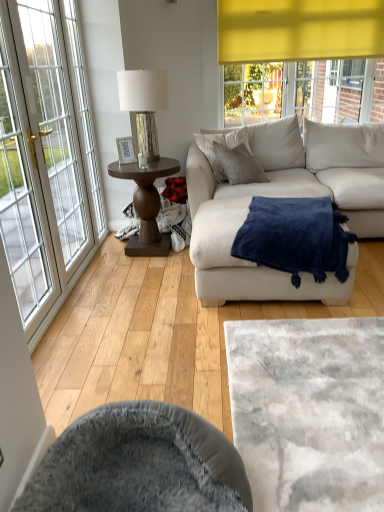
In order to face velvet grey swivel chair at lower center, should I rotate leftwards or rightwards?

Rotate your view left by about 6.720°.

Consider the image. Measure the distance between point (x=141, y=123) and camera.

The distance of point (x=141, y=123) from camera is 3.03 meters.

Describe the element at coordinates (285, 196) in the screenshot. I see `beige fabric couch at center` at that location.

Describe the element at coordinates (309, 411) in the screenshot. I see `velvety gray cat bed at lower center` at that location.

Find the location of a particular element. This screenshot has height=512, width=384. velvety gray cat bed at lower center is located at coordinates (309, 411).

This screenshot has width=384, height=512. In order to click on velvet grey swivel chair at lower center in this screenshot , I will do `click(139, 464)`.

Find the location of a particular element. window lying in front of the metallic silver table lamp at center left is located at coordinates (47, 157).

Could you tell me if white glass window at left is turned towards metallic silver table lamp at center left?

Yes, white glass window at left is aimed at metallic silver table lamp at center left.

Between white glass window at left and metallic silver table lamp at center left, which one has larger width?

With larger width is metallic silver table lamp at center left.

From the image's perspective, would you say white glass window at left is shown under metallic silver table lamp at center left?

Correct, white glass window at left appears lower than metallic silver table lamp at center left in the image.

From the image's perspective, which is below, navy blue plush blanket at center or velvety gray cat bed at lower center?

From the image's view, velvety gray cat bed at lower center is below.

Is navy blue plush blanket at center not within velvety gray cat bed at lower center?

Yes, navy blue plush blanket at center is located beyond the bounds of velvety gray cat bed at lower center.

Does navy blue plush blanket at center lie behind velvety gray cat bed at lower center?

Yes, navy blue plush blanket at center is further from the viewer.

How different are the orientations of navy blue plush blanket at center and velvety gray cat bed at lower center in degrees?

There is a 91.2-degree angle between the facing directions of navy blue plush blanket at center and velvety gray cat bed at lower center.

Between point (213, 173) and point (14, 2), which one is positioned in front?

The point (14, 2) is closer to the camera.

Which of these two, textured gray pillow at center or white glass window at left, stands taller?

With more height is white glass window at left.

Would you say white glass window at left is part of textured gray pillow at center's contents?

That's incorrect, white glass window at left is not inside textured gray pillow at center.

Considering the relative positions of textured gray pillow at center and white glass window at left in the image provided, is textured gray pillow at center to the right of white glass window at left from the viewer's perspective?

Indeed, textured gray pillow at center is positioned on the right side of white glass window at left.

Is beige fabric couch at center positioned beyond the bounds of textured gray pillow at center?

Indeed, beige fabric couch at center is completely outside textured gray pillow at center.

From a real-world perspective, who is located lower, beige fabric couch at center or textured gray pillow at center?

beige fabric couch at center, from a real-world perspective.

Is beige fabric couch at center oriented away from textured gray pillow at center?

That's right, beige fabric couch at center is facing away from textured gray pillow at center.

Is beige fabric couch at center closer to camera compared to textured gray pillow at center?

Yes, beige fabric couch at center is closer to the viewer.

Looking at this image, which of these two, light brown wood flooring at center or dark brown wood side table at center left, is wider?

With larger width is light brown wood flooring at center.

From the image's perspective, is light brown wood flooring at center over dark brown wood side table at center left?

No.

Does light brown wood flooring at center touch dark brown wood side table at center left?

No, light brown wood flooring at center is not making contact with dark brown wood side table at center left.

From their relative heights in the image, would you say white glass window at left is taller or shorter than light brown wood flooring at center?

Clearly, white glass window at left is taller compared to light brown wood flooring at center.

Looking at this image, from a real-world perspective, who is located lower, white glass window at left or light brown wood flooring at center?

light brown wood flooring at center is physically lower.

Is white glass window at left oriented towards light brown wood flooring at center?

Yes.

Looking at this image, can we say white glass window at left lies outside light brown wood flooring at center?

That's correct, white glass window at left is outside of light brown wood flooring at center.

Based on the photo, is light brown wood flooring at center a part of navy blue plush blanket at center?

No, light brown wood flooring at center is located outside of navy blue plush blanket at center.

Who is shorter, navy blue plush blanket at center or light brown wood flooring at center?

light brown wood flooring at center.

Does navy blue plush blanket at center have a smaller size compared to light brown wood flooring at center?

Yes.

This screenshot has width=384, height=512. In order to click on window below the metallic silver table lamp at center left (from the image's perspective) in this screenshot , I will do `click(47, 157)`.

You are a GUI agent. You are given a task and a screenshot of the screen. Output one action in this format:
    pyautogui.click(x=<x>, y=<y>)
    Task: Click on the cat bed in front of the navy blue plush blanket at center
    The image size is (384, 512).
    Given the screenshot: What is the action you would take?
    pyautogui.click(x=309, y=411)

Which object lies further to the anchor point white glass window at left, beige fabric couch at center or velvet grey swivel chair at lower center?

velvet grey swivel chair at lower center.

Looking at this image, based on their spatial positions, is velvety gray cat bed at lower center or dark brown wood side table at center left further from beige fabric couch at center?

velvety gray cat bed at lower center.

When comparing their distances from velvety gray cat bed at lower center, does metallic silver table lamp at center left or light brown wood flooring at center seem further?

metallic silver table lamp at center left is positioned further to the anchor velvety gray cat bed at lower center.

Estimate the real-world distances between objects in this image. Which object is further from light brown wood flooring at center, white glass window at left or velvety gray cat bed at lower center?

Based on the image, white glass window at left appears to be further to light brown wood flooring at center.

Looking at the image, which one is located closer to dark brown wood side table at center left, velvet grey swivel chair at lower center or beige fabric couch at center?

The object closer to dark brown wood side table at center left is beige fabric couch at center.

Considering their positions, is dark brown wood side table at center left positioned closer to beige fabric couch at center than metallic silver table lamp at center left?

Among the two, dark brown wood side table at center left is located nearer to beige fabric couch at center.

Based on their spatial positions, is navy blue plush blanket at center or beige fabric couch at center further from velvety gray cat bed at lower center?

beige fabric couch at center is positioned further to the anchor velvety gray cat bed at lower center.

Estimate the real-world distances between objects in this image. Which object is closer to dark brown wood side table at center left, metallic silver table lamp at center left or beige fabric couch at center?

metallic silver table lamp at center left.

Locate an element on the screen. coffee table between white glass window at left and textured gray pillow at center along the z-axis is located at coordinates (146, 204).

This screenshot has width=384, height=512. Identify the location of hardwood between velvet grey swivel chair at lower center and textured gray pillow at center in the front-back direction. (161, 335).

At what (x,y) coordinates should I click in order to perform the action: click on hardwood situated between white glass window at left and velvety gray cat bed at lower center from left to right. Please return your answer as a coordinate pair (x, y). Looking at the image, I should click on (161, 335).

Where is `window located between velvety gray cat bed at lower center and metallic silver table lamp at center left in the depth direction`? window located between velvety gray cat bed at lower center and metallic silver table lamp at center left in the depth direction is located at coordinates (47, 157).